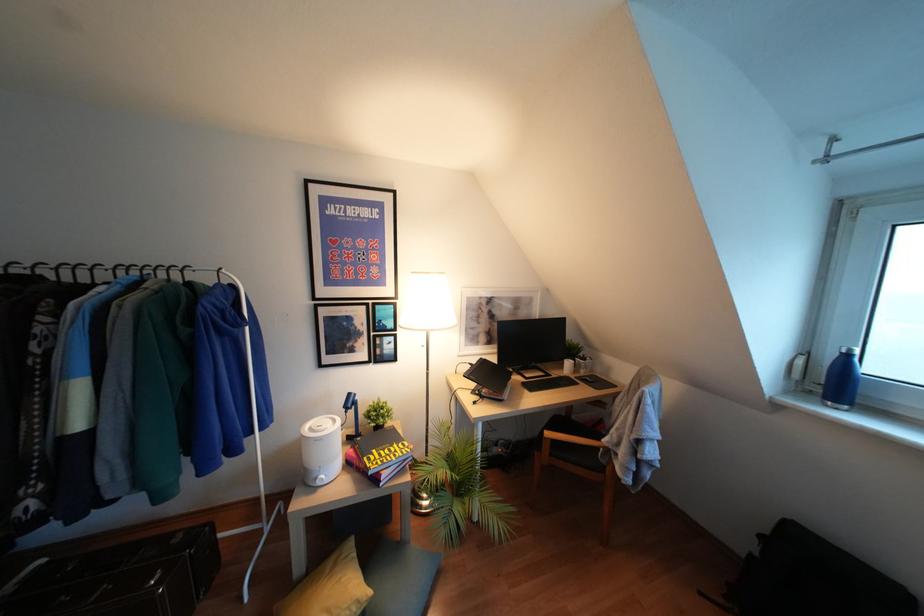
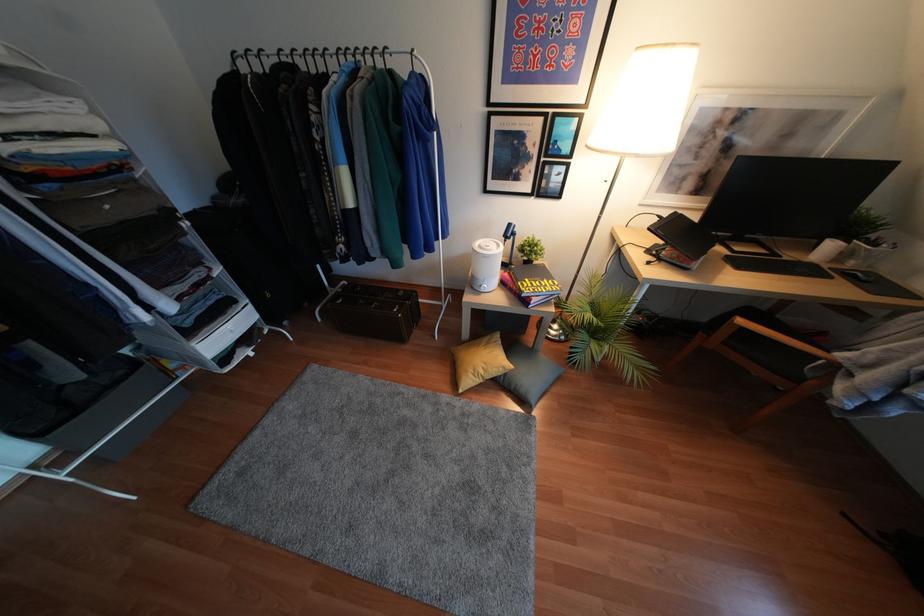
Find the pixel in the second image that matches the point at 546,434 in the first image.

(739, 321)